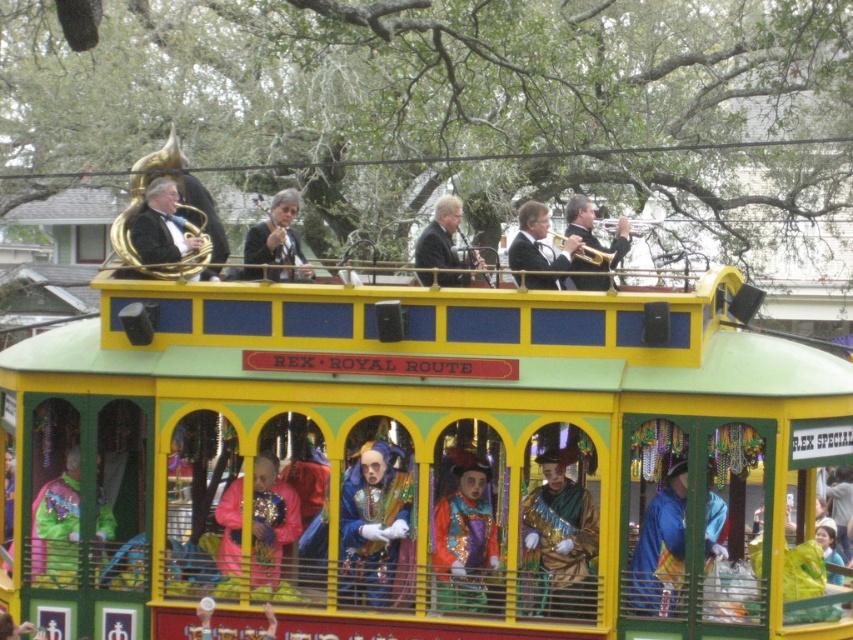
Which is more to the left, shiny multicolored costume at center or shiny gold trumpet at upper center?

Positioned to the left is shiny multicolored costume at center.

Between point (451, 460) and point (614, 243), which one is positioned behind?

The point (614, 243) is behind.

Find the location of a particular element. shiny multicolored costume at center is located at coordinates (462, 532).

Can you confirm if pink velvet mask at center is positioned above matte black jacket at center?

No, pink velvet mask at center is not above matte black jacket at center.

Which of these two, pink velvet mask at center or matte black jacket at center, stands shorter?

pink velvet mask at center is shorter.

Is point (285, 524) positioned behind point (273, 230)?

No.

Find the location of a particular element. This screenshot has height=640, width=853. pink velvet mask at center is located at coordinates (271, 529).

Based on the photo, measure the distance from gold metallic mask at center to matte gold tuba at upper left.

gold metallic mask at center and matte gold tuba at upper left are 18.06 feet apart from each other.

Describe the element at coordinates (558, 541) in the screenshot. I see `gold metallic mask at center` at that location.

Where is `gold metallic mask at center`? Image resolution: width=853 pixels, height=640 pixels. gold metallic mask at center is located at coordinates (558, 541).